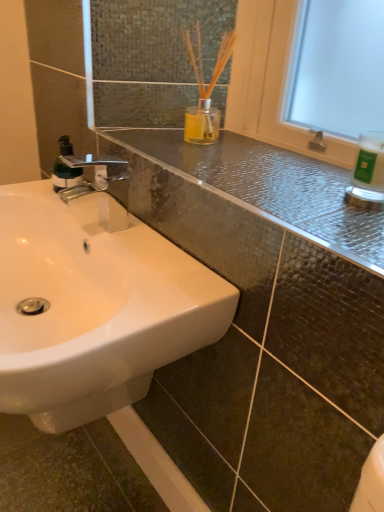
Question: From the image's perspective, is green matte bottle at left above or below white glossy bottle at upper right?

Choices:
 (A) above
 (B) below

Answer: (A)

Question: Considering the positions of green matte bottle at left and white glossy bottle at upper right in the image, is green matte bottle at left taller or shorter than white glossy bottle at upper right?

Choices:
 (A) short
 (B) tall

Answer: (B)

Question: Which object is the farthest from the green matte bottle at left?

Choices:
 (A) white glossy sink at lower left
 (B) glossy ceramic counter top at upper center
 (C) white glossy bottle at upper right

Answer: (C)

Question: Estimate the real-world distances between objects in this image. Which object is farther from the white glossy bottle at upper right?

Choices:
 (A) white glossy sink at lower left
 (B) glossy ceramic counter top at upper center
 (C) green matte bottle at left

Answer: (C)